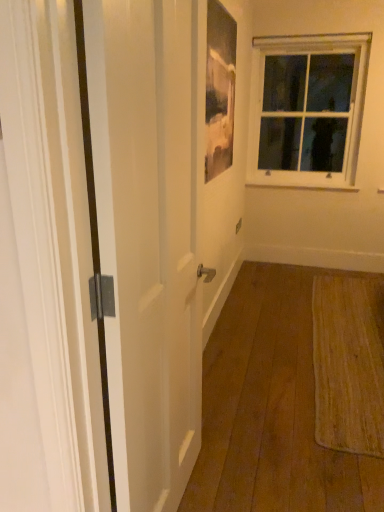
Question: In terms of size, does white glossy door at left appear bigger or smaller than clear glass window at upper right?

Choices:
 (A) big
 (B) small

Answer: (B)

Question: Is white glossy door at left taller or shorter than clear glass window at upper right?

Choices:
 (A) tall
 (B) short

Answer: (A)

Question: Estimate the real-world distances between objects in this image. Which object is farther from the white glossy door at left?

Choices:
 (A) matte glass picture frame at upper center
 (B) clear glass window at upper right
 (C) white painted wood at upper right

Answer: (C)

Question: Which of these objects is positioned closest to the white painted wood at upper right?

Choices:
 (A) clear glass window at upper right
 (B) white glossy door at left
 (C) matte glass picture frame at upper center

Answer: (A)